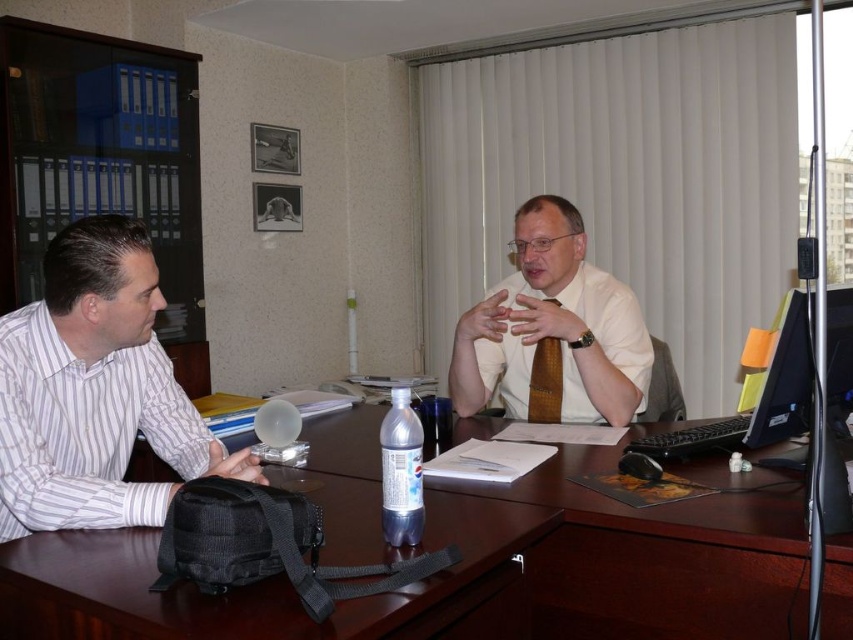
You are a photographer trying to capture a portrait of both individuals at the same time. Given that the striped cotton shirt at left and brown woven tie at right are the focal points, will you need to adjust your camera angle to ensure both are fully visible in the frame?

The striped cotton shirt at left might be wider than brown woven tie at right, so adjusting the camera angle may be necessary to ensure both are fully visible in the frame.

You are standing in the office scene described. There are two points marked in the image, one at coordinates point (9,358) and the other at point (546,417). Which point is closer to you?

Point (9,358) is closer to the viewer than point (546,417).